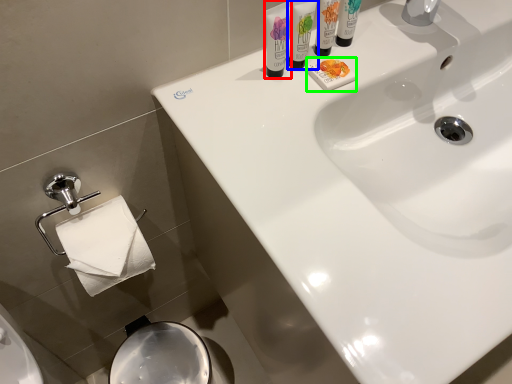
Question: Based on their relative distances, which object is farther from shaving cream (highlighted by a red box)? Choose from shaving cream (highlighted by a blue box) and soap (highlighted by a green box).

Choices:
 (A) shaving cream
 (B) soap

Answer: (B)